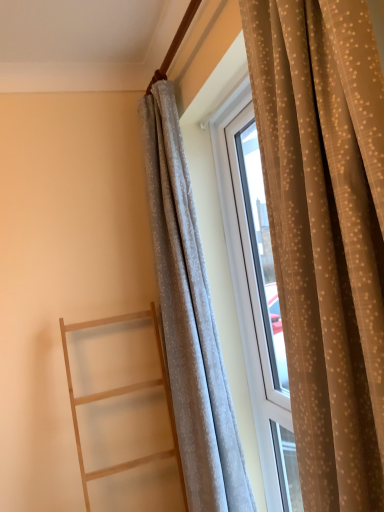
Question: Is white sheer curtain at center, the 2th curtain from the front, oriented towards light gray sheer curtain at right, marked as the 2th curtain in a back-to-front arrangement?

Choices:
 (A) yes
 (B) no

Answer: (B)

Question: Can you confirm if white sheer curtain at center, positioned as the 1th curtain in back-to-front order, is wider than light gray sheer curtain at right, marked as the 2th curtain in a back-to-front arrangement?

Choices:
 (A) no
 (B) yes

Answer: (A)

Question: From a real-world perspective, is white sheer curtain at center, the 2th curtain from the front, positioned over light gray sheer curtain at right, positioned as the 1th curtain in front-to-back order, based on gravity?

Choices:
 (A) no
 (B) yes

Answer: (A)

Question: Is white sheer curtain at center, the 2th curtain from the front, not close to light gray sheer curtain at right, positioned as the 1th curtain in front-to-back order?

Choices:
 (A) no
 (B) yes

Answer: (A)

Question: From the image's perspective, is white sheer curtain at center, the 2th curtain from the front, over light gray sheer curtain at right, positioned as the 1th curtain in front-to-back order?

Choices:
 (A) no
 (B) yes

Answer: (A)

Question: From the image's perspective, is light gray sheer curtain at right, marked as the 2th curtain in a back-to-front arrangement, located above or below light wood ladder at left?

Choices:
 (A) above
 (B) below

Answer: (A)

Question: Relative to light wood ladder at left, is light gray sheer curtain at right, marked as the 2th curtain in a back-to-front arrangement, in front or behind?

Choices:
 (A) behind
 (B) front

Answer: (B)

Question: In terms of size, does light gray sheer curtain at right, positioned as the 1th curtain in front-to-back order, appear bigger or smaller than light wood ladder at left?

Choices:
 (A) small
 (B) big

Answer: (B)

Question: Visually, is light gray sheer curtain at right, marked as the 2th curtain in a back-to-front arrangement, positioned to the left or to the right of light wood ladder at left?

Choices:
 (A) right
 (B) left

Answer: (A)

Question: Considering the positions of white sheer curtain at center, the 2th curtain from the front, and light wood ladder at left in the image, is white sheer curtain at center, the 2th curtain from the front, wider or thinner than light wood ladder at left?

Choices:
 (A) wide
 (B) thin

Answer: (B)

Question: Visually, is white sheer curtain at center, the 2th curtain from the front, positioned to the left or to the right of light wood ladder at left?

Choices:
 (A) right
 (B) left

Answer: (A)

Question: Does point (x=193, y=356) appear closer or farther from the camera than point (x=79, y=398)?

Choices:
 (A) farther
 (B) closer

Answer: (B)

Question: From the image's perspective, relative to light wood ladder at left, is white sheer curtain at center, positioned as the 1th curtain in back-to-front order, above or below?

Choices:
 (A) below
 (B) above

Answer: (B)

Question: Is point 137,461 positioned closer to the camera than point 266,173?

Choices:
 (A) closer
 (B) farther

Answer: (B)

Question: Do you think light wood ladder at left is within light gray sheer curtain at right, positioned as the 1th curtain in front-to-back order, or outside of it?

Choices:
 (A) inside
 (B) outside

Answer: (B)